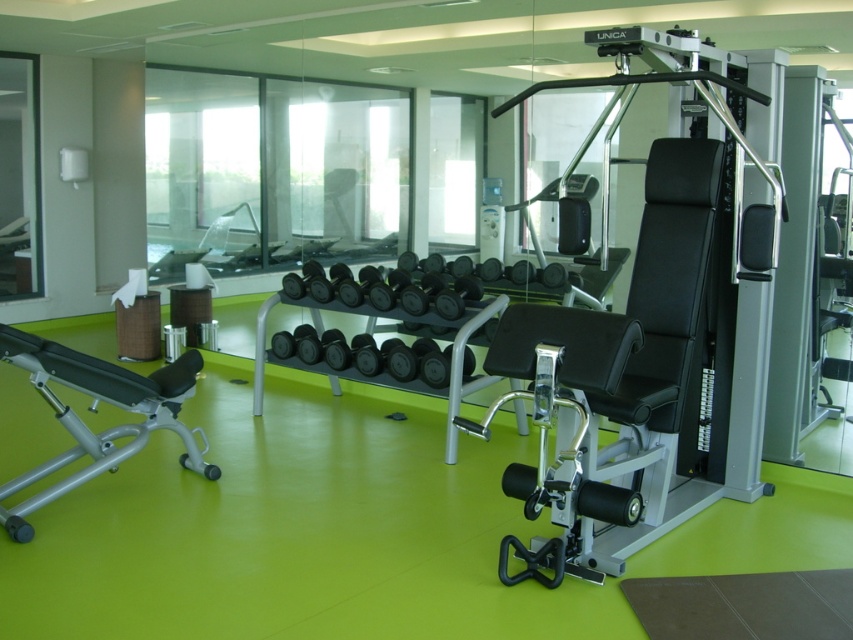
From the picture: Who is taller, matte black bench at left or black rubber dumbbells at center?

Standing taller between the two is matte black bench at left.

Between matte black bench at left and black rubber dumbbells at center, which one has less height?

With less height is black rubber dumbbells at center.

This screenshot has height=640, width=853. What do you see at coordinates (94, 412) in the screenshot? I see `matte black bench at left` at bounding box center [94, 412].

Identify the location of matte black bench at left. This screenshot has width=853, height=640. (94, 412).

Who is positioned more to the left, black rubber dumbbells at center or black rubber dumbbell at center?

black rubber dumbbells at center is more to the left.

Does black rubber dumbbells at center have a lesser height compared to black rubber dumbbell at center?

→ No.

The image size is (853, 640). Find the location of `black rubber dumbbells at center`. black rubber dumbbells at center is located at coordinates (415, 284).

Between matte black bench at left and black rubber dumbbell at center, which one has more height?

matte black bench at left

Where is `matte black bench at left`? matte black bench at left is located at coordinates (94, 412).

Does point (57, 404) come in front of point (505, 470)?

No, (57, 404) is further to viewer.

What are the coordinates of `matte black bench at left` in the screenshot? It's located at (94, 412).